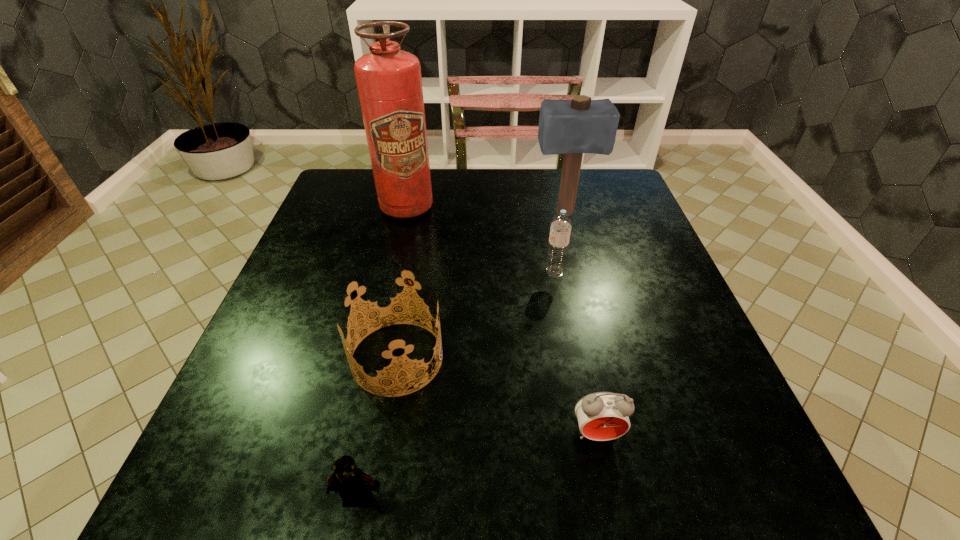
This screenshot has width=960, height=540. Identify the location of free point at the left edge. (323, 353).

You are a GUI agent. You are given a task and a screenshot of the screen. Output one action in this format:
    pyautogui.click(x=<x>, y=<y>)
    Task: Click on the free space at the right edge of the desktop
    This screenshot has height=540, width=960.
    Given the screenshot: What is the action you would take?
    pyautogui.click(x=628, y=372)

I want to click on free region at the far left corner of the desktop, so click(x=341, y=171).

Where is `vacant region at the far right corner`? The image size is (960, 540). vacant region at the far right corner is located at coordinates (602, 190).

Where is `empty space between the Lego and the fifth shortest object`? empty space between the Lego and the fifth shortest object is located at coordinates (461, 356).

This screenshot has width=960, height=540. What are the coordinates of `free space between the Lego and the crown` in the screenshot? It's located at (377, 428).

The width and height of the screenshot is (960, 540). Identify the location of empty space between the crown and the Lego. (377, 428).

Where is `free area in between the crown and the second tallest object`? The width and height of the screenshot is (960, 540). free area in between the crown and the second tallest object is located at coordinates (481, 286).

Find the location of a particular element. free space between the nearest object and the fourth nearest object is located at coordinates (456, 386).

Where is `empty space that is in between the fifth shortest object and the nearest object`? empty space that is in between the fifth shortest object and the nearest object is located at coordinates (461, 356).